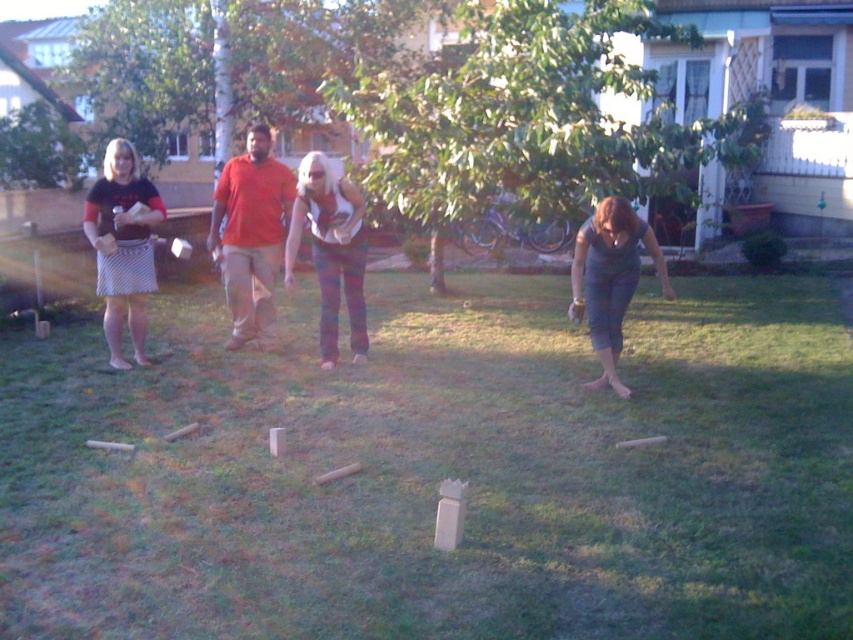
Can you confirm if green leafy tree at center is wider than striped cotton skirt at left?

Yes, green leafy tree at center is wider than striped cotton skirt at left.

Can you confirm if green leafy tree at center is taller than striped cotton skirt at left?

No, green leafy tree at center is not taller than striped cotton skirt at left.

Is point (671, 184) farther from camera compared to point (115, 336)?

Yes, point (671, 184) is farther from viewer.

Find the location of a particular element. green leafy tree at center is located at coordinates (527, 115).

Does striped cotton skirt at left have a lesser height compared to matte gray tank top at lower right?

Incorrect, striped cotton skirt at left's height does not fall short of matte gray tank top at lower right's.

Is striped cotton skirt at left below matte gray tank top at lower right?

No.

Which is behind, point (143, 321) or point (659, 266)?

The point (143, 321) is more distant.

At what (x,y) coordinates should I click in order to perform the action: click on striped cotton skirt at left. Please return your answer as a coordinate pair (x, y). The height and width of the screenshot is (640, 853). Looking at the image, I should click on (122, 244).

Which is more to the left, green grass at center or matte gray tank top at lower right?

green grass at center

Find the location of `green grass at center`. green grass at center is located at coordinates (440, 474).

Where is `green grass at center`? The image size is (853, 640). green grass at center is located at coordinates point(440,474).